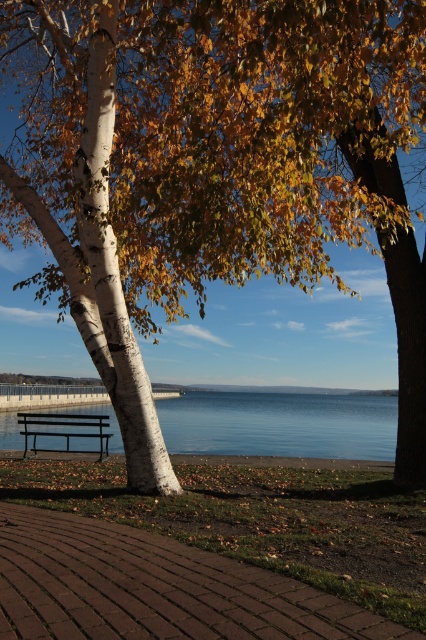
Does white bark birch tree at left appear over clear blue water at center?

Yes, white bark birch tree at left is above clear blue water at center.

The height and width of the screenshot is (640, 426). I want to click on white bark birch tree at left, so click(103, 264).

Locate an element on the screen. The image size is (426, 640). white bark birch tree at left is located at coordinates (103, 264).

Can you confirm if brown brick path at lower center is positioned below clear blue water at center?

Actually, brown brick path at lower center is above clear blue water at center.

Between brown brick path at lower center and clear blue water at center, which one appears on the left side from the viewer's perspective?

Positioned to the left is brown brick path at lower center.

This screenshot has height=640, width=426. In order to click on brown brick path at lower center in this screenshot , I will do `click(154, 588)`.

Is brown brick path at lower center above metallic black bench at center?

Yes, brown brick path at lower center is above metallic black bench at center.

Is point (83, 586) closer to viewer compared to point (23, 433)?

Yes, it is.

Is point (195, 614) farther from viewer compared to point (89, 451)?

No, (195, 614) is closer to viewer.

This screenshot has height=640, width=426. I want to click on brown brick path at lower center, so click(x=154, y=588).